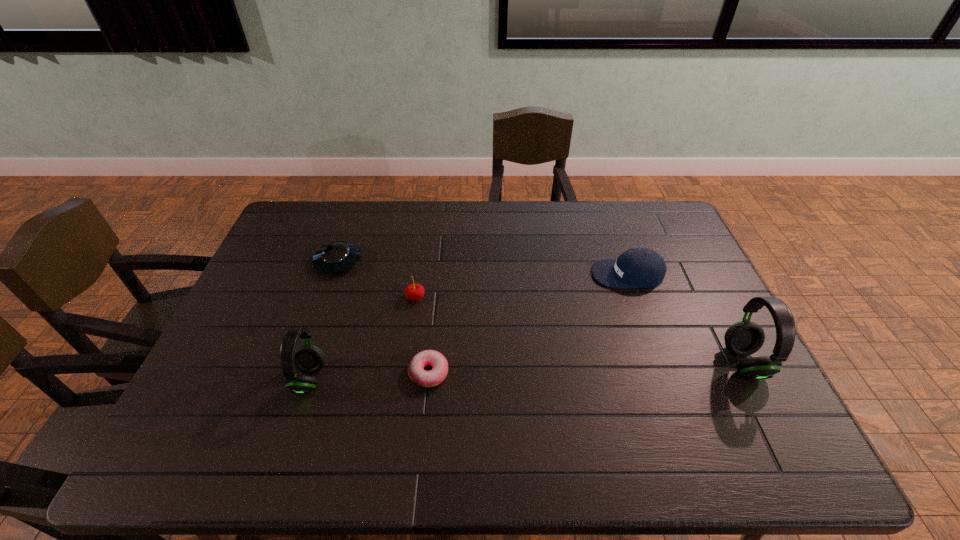
To make them evenly spaced by inserting another headset among them, please locate a free space for this new headset. Please provide its 2D coordinates. Your answer should be formatted as a tuple, i.e. [(x, y)], where the tuple contains the x and y coordinates of a point satisfying the conditions above.

[(530, 370)]